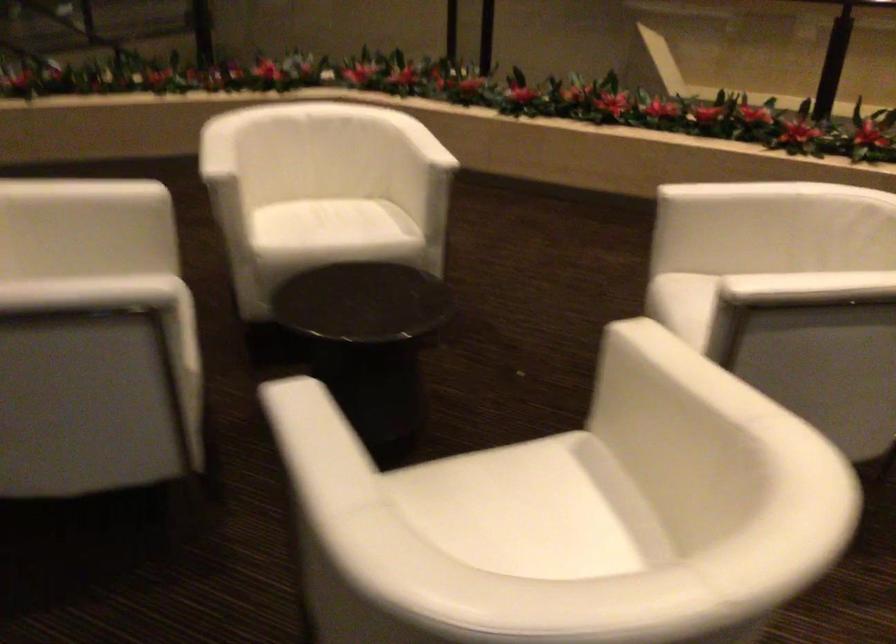
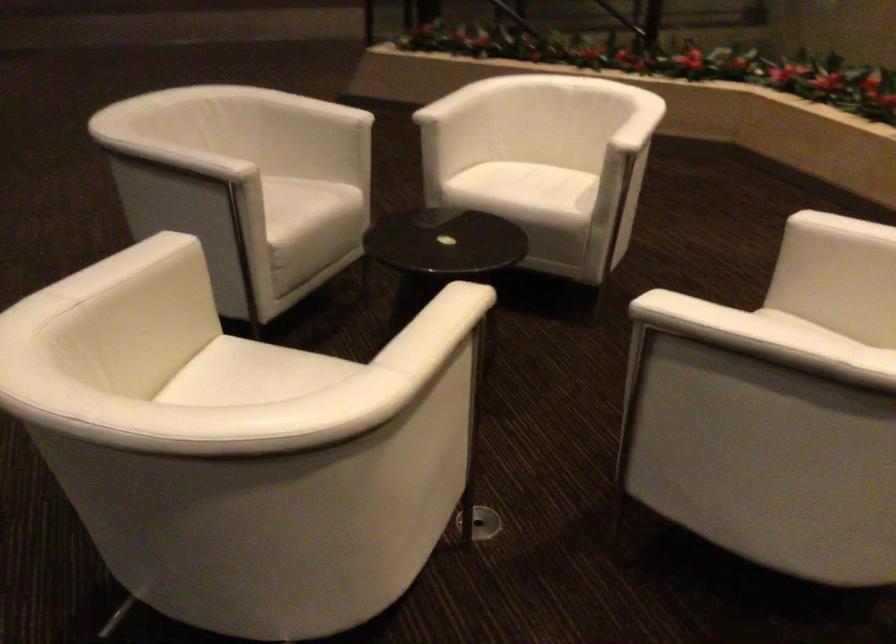
Locate, in the second image, the point that corresponds to the point at 359,234 in the first image.

(528, 194)